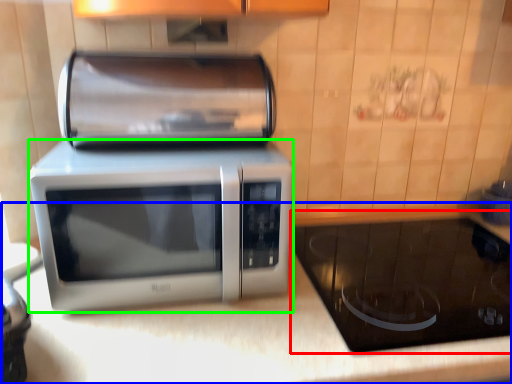
Question: Which object is the farthest from appliance (highlighted by a red box)? Choose among these: counter top (highlighted by a blue box) or microwave oven (highlighted by a green box).

Choices:
 (A) counter top
 (B) microwave oven

Answer: (B)